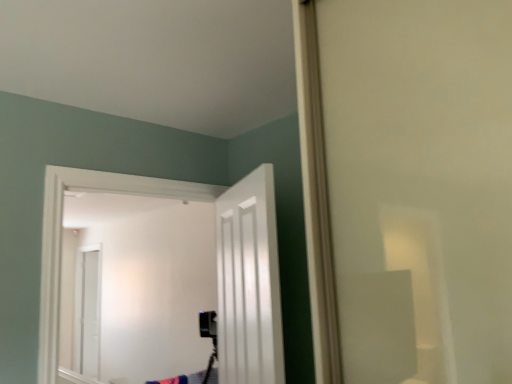
Question: From a real-world perspective, is white glossy door at center, which appears as the second door when viewed from the left, physically located above or below white glossy door at center, which appears as the first door when viewed from the left?

Choices:
 (A) below
 (B) above

Answer: (A)

Question: Is point (259, 304) positioned closer to the camera than point (48, 352)?

Choices:
 (A) farther
 (B) closer

Answer: (B)

Question: Relative to white glossy door at center, which appears as the first door when viewed from the left, is white glossy door at center, the 1th door in the right-to-left sequence, in front or behind?

Choices:
 (A) behind
 (B) front

Answer: (B)

Question: Is point (104, 309) positioned closer to the camera than point (238, 352)?

Choices:
 (A) closer
 (B) farther

Answer: (B)

Question: From the image's perspective, is white glossy door at center, which appears as the first door when viewed from the left, positioned above or below white glossy door at center, which appears as the second door when viewed from the left?

Choices:
 (A) above
 (B) below

Answer: (B)

Question: Would you say white glossy door at center, which appears as the first door when viewed from the left, is inside or outside white glossy door at center, the 1th door in the right-to-left sequence?

Choices:
 (A) inside
 (B) outside

Answer: (B)

Question: Considering the relative positions of white glossy door at center, which appears as the first door when viewed from the left, and white glossy door at center, the 1th door in the right-to-left sequence, in the image provided, is white glossy door at center, which appears as the first door when viewed from the left, to the left or to the right of white glossy door at center, the 1th door in the right-to-left sequence,?

Choices:
 (A) right
 (B) left

Answer: (B)